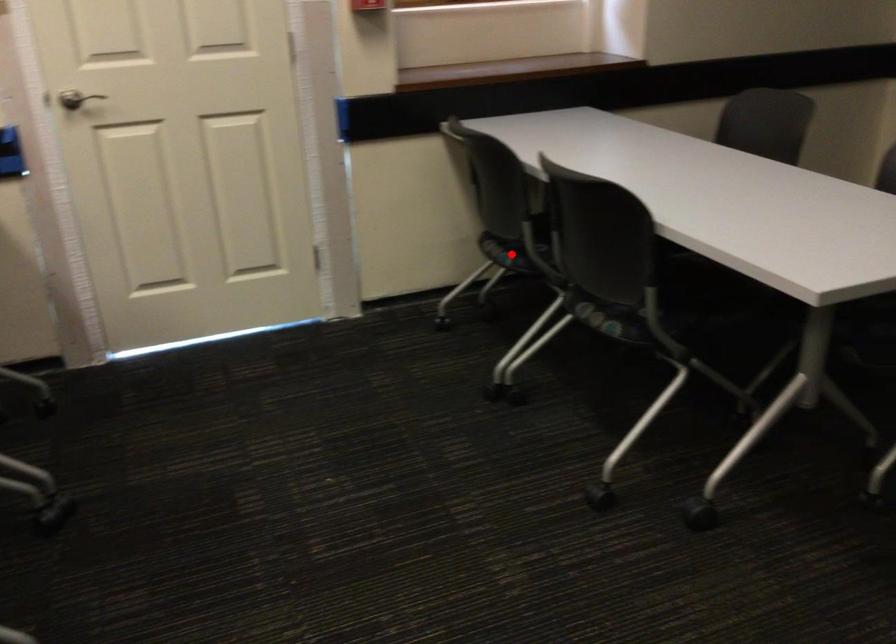
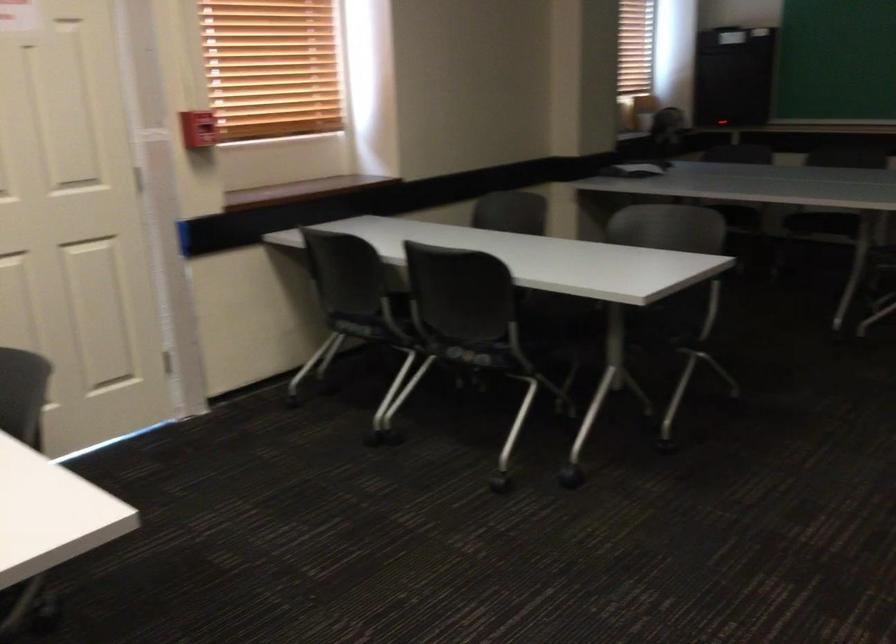
Question: I am providing you with two images of the same scene from different viewpoints. In image1, a red point is highlighted. Considering the same 3D point in image2, which of the following is correct?

Choices:
 (A) It is closer
 (B) It is farther

Answer: (B)